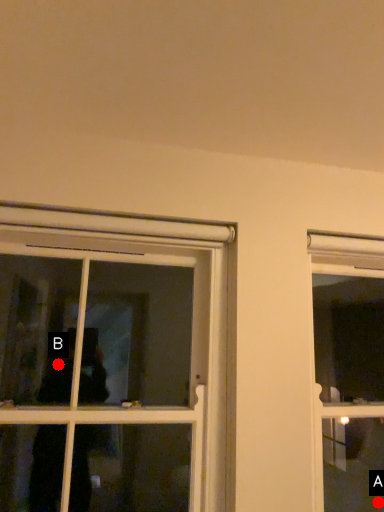
Question: Two points are circled on the image, labeled by A and B beside each circle. Which point appears farthest from the camera in this image?

Choices:
 (A) A is further
 (B) B is further

Answer: (A)